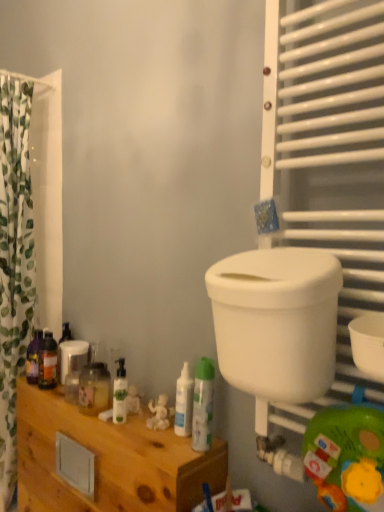
Question: From a real-world perspective, is white plastic toilet bowl at right physically above white glossy spray can at center, arranged as the 5th toiletry when viewed from the back?

Choices:
 (A) yes
 (B) no

Answer: (A)

Question: Considering the relative sizes of white plastic toilet bowl at right and white glossy spray can at center, placed as the 5th toiletry when sorted from left to right, in the image provided, is white plastic toilet bowl at right taller than white glossy spray can at center, placed as the 5th toiletry when sorted from left to right,?

Choices:
 (A) yes
 (B) no

Answer: (A)

Question: Is white plastic toilet bowl at right positioned in front of white glossy spray can at center, the 1th toiletry when ordered from front to back?

Choices:
 (A) no
 (B) yes

Answer: (B)

Question: Is white plastic toilet bowl at right in contact with white glossy spray can at center, the 1th toiletry when ordered from front to back?

Choices:
 (A) yes
 (B) no

Answer: (B)

Question: Can you confirm if white plastic toilet bowl at right is positioned to the right of white glossy spray can at center, the 1th toiletry when ordered from front to back?

Choices:
 (A) yes
 (B) no

Answer: (A)

Question: Considering the relative sizes of white plastic toilet bowl at right and white glossy spray can at center, arranged as the 5th toiletry when viewed from the back, in the image provided, is white plastic toilet bowl at right shorter than white glossy spray can at center, arranged as the 5th toiletry when viewed from the back,?

Choices:
 (A) yes
 (B) no

Answer: (B)

Question: From a real-world perspective, does wooden cabinet at lower left sit lower than white plastic toilet bowl at right?

Choices:
 (A) no
 (B) yes

Answer: (B)

Question: Would you say wooden cabinet at lower left is a long distance from white plastic toilet bowl at right?

Choices:
 (A) yes
 (B) no

Answer: (B)

Question: Does wooden cabinet at lower left appear on the right side of white plastic toilet bowl at right?

Choices:
 (A) no
 (B) yes

Answer: (A)

Question: Is wooden cabinet at lower left shorter than white plastic toilet bowl at right?

Choices:
 (A) no
 (B) yes

Answer: (A)

Question: Could you tell me if wooden cabinet at lower left is facing white plastic toilet bowl at right?

Choices:
 (A) yes
 (B) no

Answer: (B)

Question: Does wooden cabinet at lower left lie behind white plastic toilet bowl at right?

Choices:
 (A) yes
 (B) no

Answer: (A)

Question: Considering the relative sizes of white glossy pump bottle at center, the 3th toiletry when ordered from left to right, and translucent plastic bottle at left, which appears as the 1th toiletry when viewed from the back, in the image provided, is white glossy pump bottle at center, the 3th toiletry when ordered from left to right, bigger than translucent plastic bottle at left, which appears as the 1th toiletry when viewed from the back,?

Choices:
 (A) no
 (B) yes

Answer: (A)